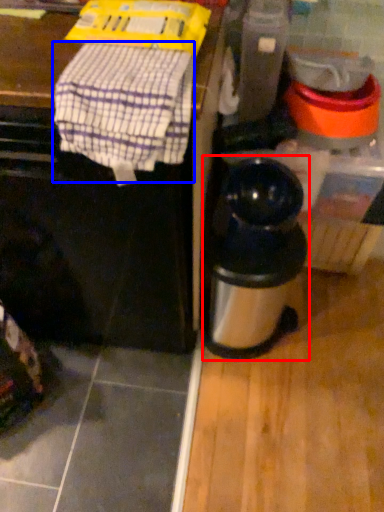
Question: Which of the following is the farthest to the observer, kitchen appliance (highlighted by a red box) or blanket (highlighted by a blue box)?

Choices:
 (A) kitchen appliance
 (B) blanket

Answer: (A)